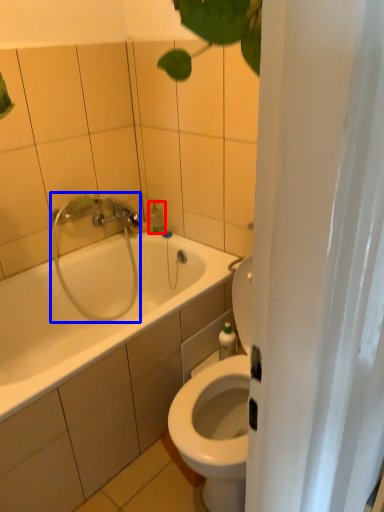
Question: Which object is closer to the camera taking this photo, soap dispenser (highlighted by a red box) or shower (highlighted by a blue box)?

Choices:
 (A) soap dispenser
 (B) shower

Answer: (B)